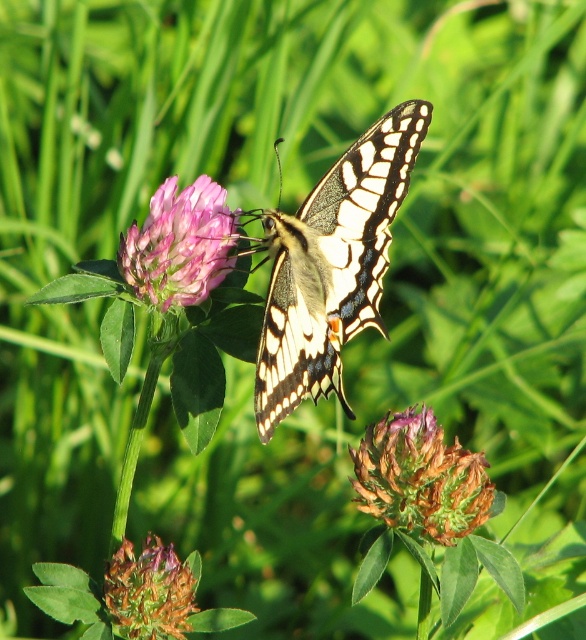
Does pink velvet clover at center appear on the right side of brown textured flower at lower left?

Correct, you'll find pink velvet clover at center to the right of brown textured flower at lower left.

You are a GUI agent. You are given a task and a screenshot of the screen. Output one action in this format:
    pyautogui.click(x=<x>, y=<y>)
    Task: Click on the pink velvet clover at center
    Image resolution: width=586 pixels, height=640 pixels.
    Given the screenshot: What is the action you would take?
    pyautogui.click(x=178, y=244)

Who is more forward, (x=180, y=280) or (x=154, y=614)?

Positioned in front is point (x=154, y=614).

You are a GUI agent. You are given a task and a screenshot of the screen. Output one action in this format:
    pyautogui.click(x=<x>, y=<y>)
    Task: Click on the pink velvet clover at center
    The image size is (586, 640).
    Given the screenshot: What is the action you would take?
    pyautogui.click(x=178, y=244)

Can you confirm if translucent yellow butterfly at center is thinner than brown textured flower at lower left?

No.

Is translucent yellow butterfly at center behind brown textured flower at lower left?

No, it is in front of brown textured flower at lower left.

Find the location of a particular element. This screenshot has height=640, width=586. translucent yellow butterfly at center is located at coordinates (331, 266).

The width and height of the screenshot is (586, 640). Identify the location of translucent yellow butterfly at center. (331, 266).

Consider the image. Can you confirm if brown fuzzy flower at lower center is wider than pink velvet clover at center?

Indeed, brown fuzzy flower at lower center has a greater width compared to pink velvet clover at center.

Is brown fuzzy flower at lower center positioned in front of pink velvet clover at center?

Yes, it is.

The height and width of the screenshot is (640, 586). Find the location of `brown fuzzy flower at lower center`. brown fuzzy flower at lower center is located at coordinates (420, 477).